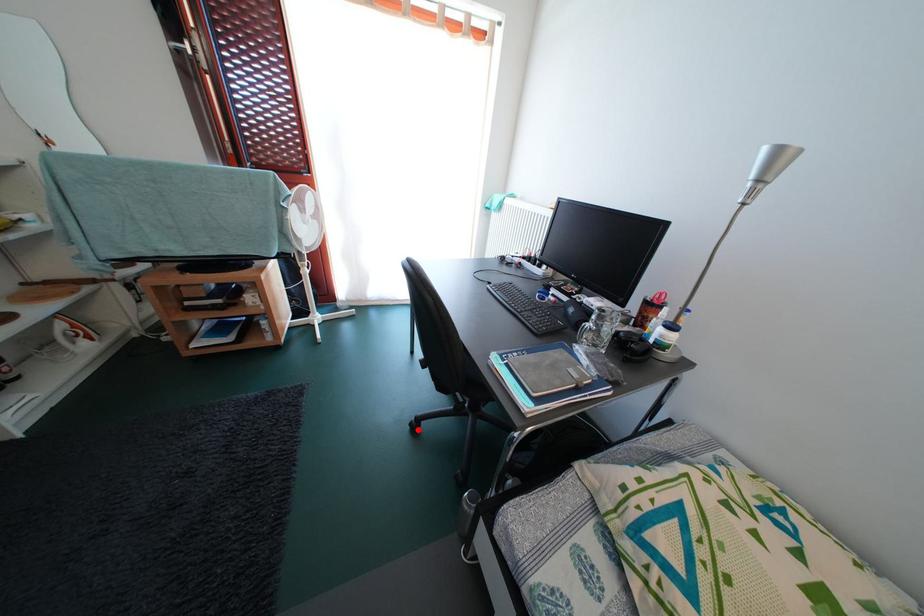
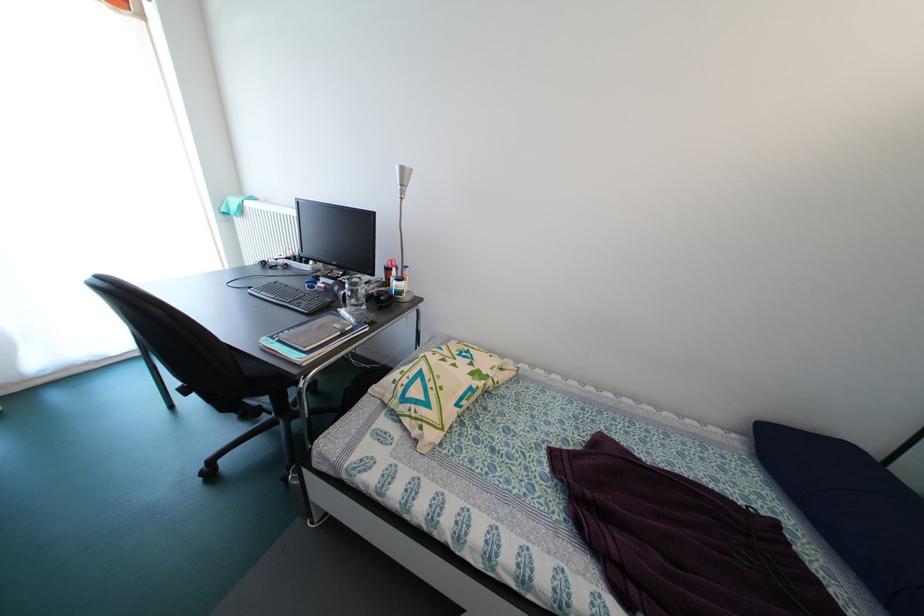
Question: I am providing you with two images of the same scene from different viewpoints. A red point is shown in image1. For the corresponding object point in image2, is it positioned nearer or farther from the camera?

Choices:
 (A) Nearer
 (B) Farther

Answer: (A)